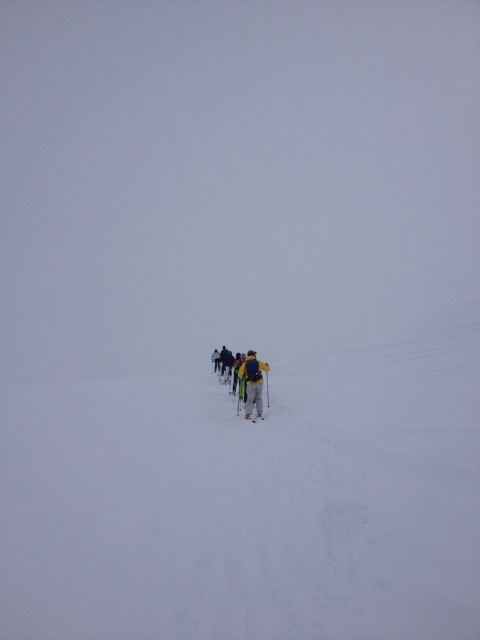
You are a hiker who needs to decide whether to carry the yellow fabric backpack at center or the yellow matte ski at center. Based on their sizes, which one takes up more space?

The yellow fabric backpack at center is bigger than the yellow matte ski at center, so it takes up more space.

You are a hiker trying to locate your backpack in a snowfield. You remember that your backpack is at a specific coordinate point. Where is the yellow fabric backpack at center located?

The yellow fabric backpack at center is located at point [252,381].